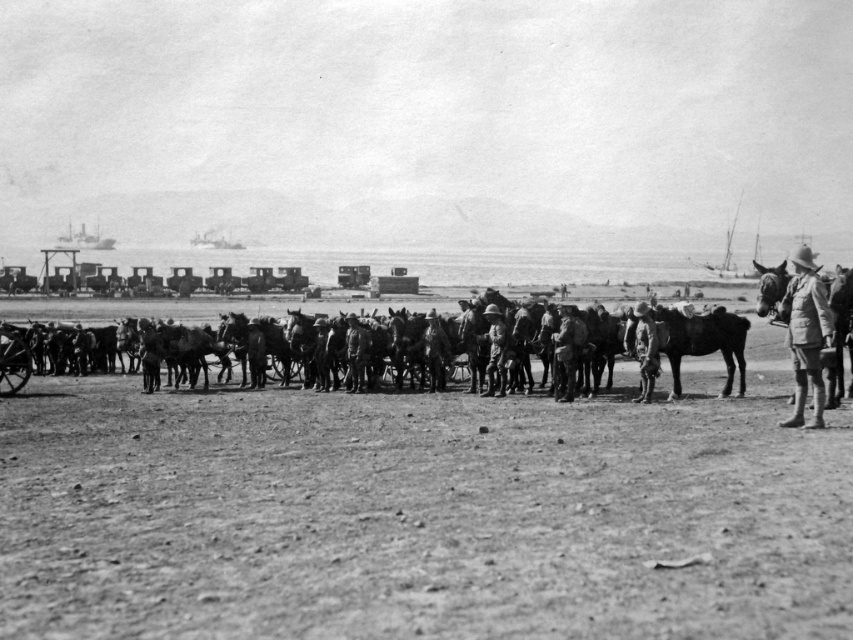
Question: Which point is closer to the camera?

Choices:
 (A) (641, 333)
 (B) (786, 310)
 (C) (421, 616)

Answer: (C)

Question: Is khaki uniform at center wider than camouflage fabric uniform at center?

Choices:
 (A) no
 (B) yes

Answer: (B)

Question: Which point is closer to the camera?

Choices:
 (A) dirt field at center
 (B) khaki uniform at center
 (C) camouflage fabric uniform at center

Answer: (A)

Question: Is khaki uniform at center above camouflage fabric uniform at center?

Choices:
 (A) no
 (B) yes

Answer: (B)

Question: Does dirt field at center have a greater width compared to khaki uniform at center?

Choices:
 (A) no
 (B) yes

Answer: (B)

Question: Which object is positioned farthest from the khaki uniform at center?

Choices:
 (A) camouflage fabric uniform at center
 (B) dirt field at center

Answer: (B)